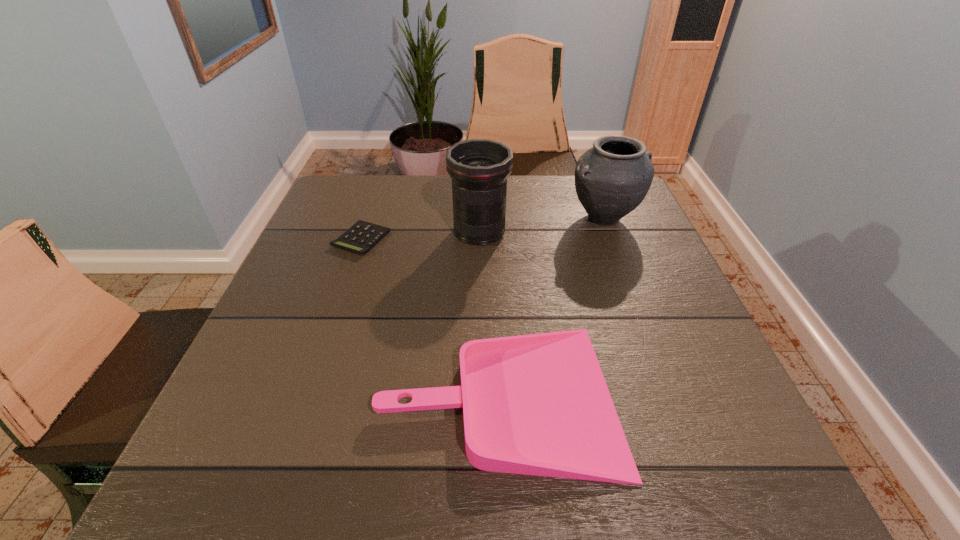
You are a GUI agent. You are given a task and a screenshot of the screen. Output one action in this format:
    pyautogui.click(x=<x>, y=<y>)
    Task: Click on the blank space at the left edge of the desktop
    The height and width of the screenshot is (540, 960).
    Given the screenshot: What is the action you would take?
    (352, 258)

In the image, there is a desktop. What are the coordinates of `vacant space at the right edge` in the screenshot? It's located at (716, 400).

The width and height of the screenshot is (960, 540). I want to click on free region at the far left corner of the desktop, so click(365, 204).

The image size is (960, 540). Find the location of `vacant area that lies between the urn and the telephoto lens`. vacant area that lies between the urn and the telephoto lens is located at coordinates (542, 225).

Identify the location of free space between the second shortest object and the leftmost object. (430, 318).

At what (x,y) coordinates should I click in order to perform the action: click on empty location between the telephoto lens and the urn. Please return your answer as a coordinate pair (x, y). This screenshot has width=960, height=540. Looking at the image, I should click on (542, 225).

Find the location of a particular element. The height and width of the screenshot is (540, 960). blank region between the telephoto lens and the dustpan is located at coordinates (489, 314).

The height and width of the screenshot is (540, 960). In order to click on empty space that is in between the telephoto lens and the dustpan in this screenshot , I will do `click(489, 314)`.

Where is `vacant space that's between the dustpan and the calculator`? The width and height of the screenshot is (960, 540). vacant space that's between the dustpan and the calculator is located at coordinates (430, 318).

At what (x,y) coordinates should I click in order to perform the action: click on vacant space that's between the third tallest object and the shortest object. Please return your answer as a coordinate pair (x, y). Looking at the image, I should click on (430, 318).